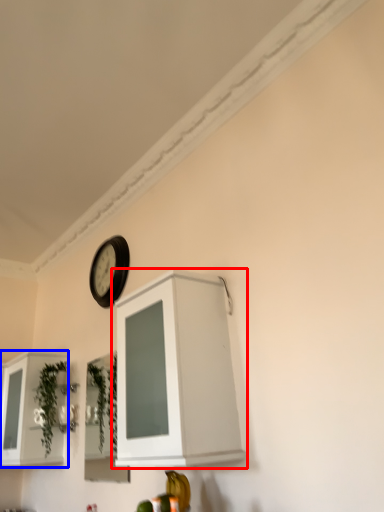
Question: Which point is further to the camera, cabinetry (highlighted by a red box) or cabinetry (highlighted by a blue box)?

Choices:
 (A) cabinetry
 (B) cabinetry

Answer: (B)